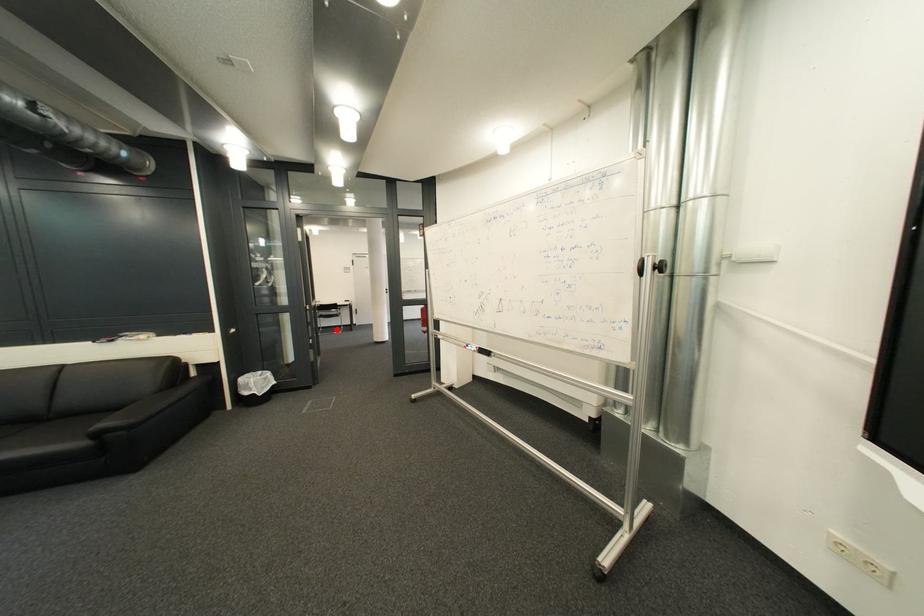
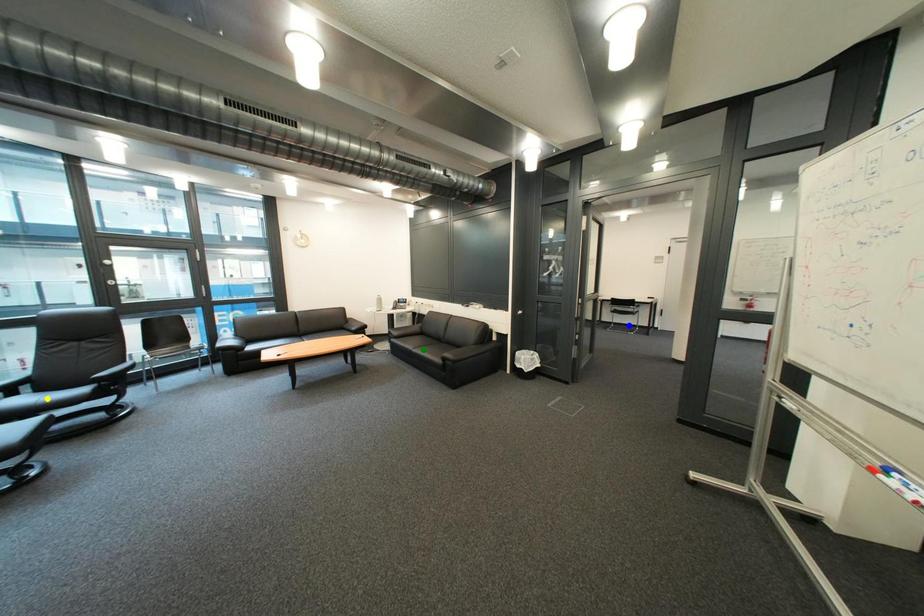
Question: I am providing you with two images of the same scene from different viewpoints. A red point is marked on the first image. You are given multiple points on the second image. Which point in image 2 represents the same 3d spot as the red point in image 1?

Choices:
 (A) green point
 (B) blue point
 (C) yellow point

Answer: (B)